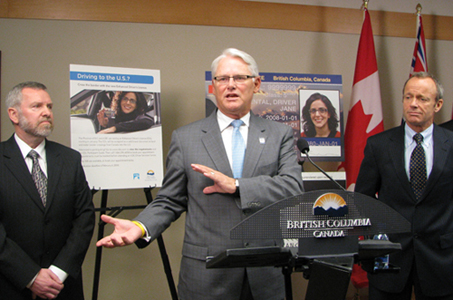
Image resolution: width=453 pixels, height=300 pixels. I want to click on wood trim, so click(x=317, y=17).